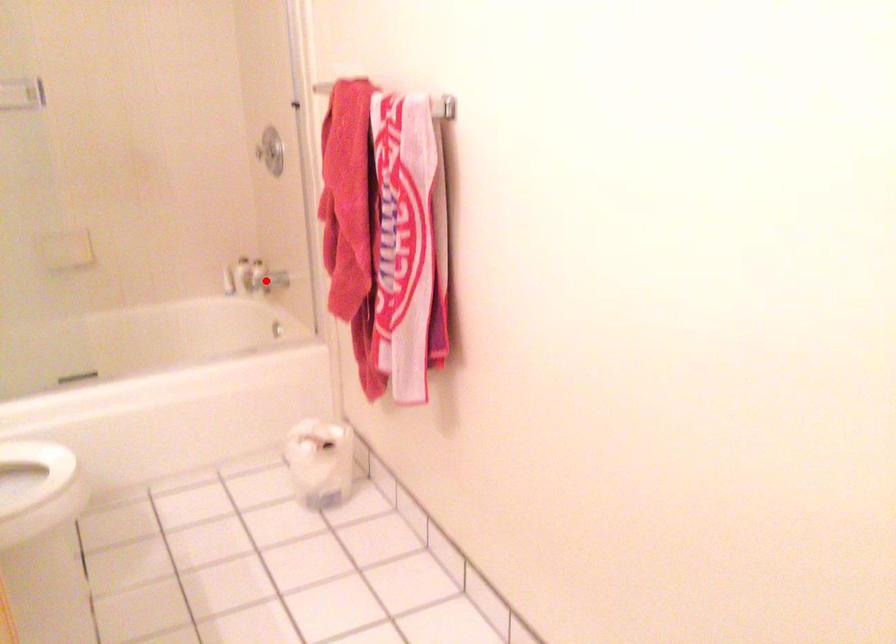
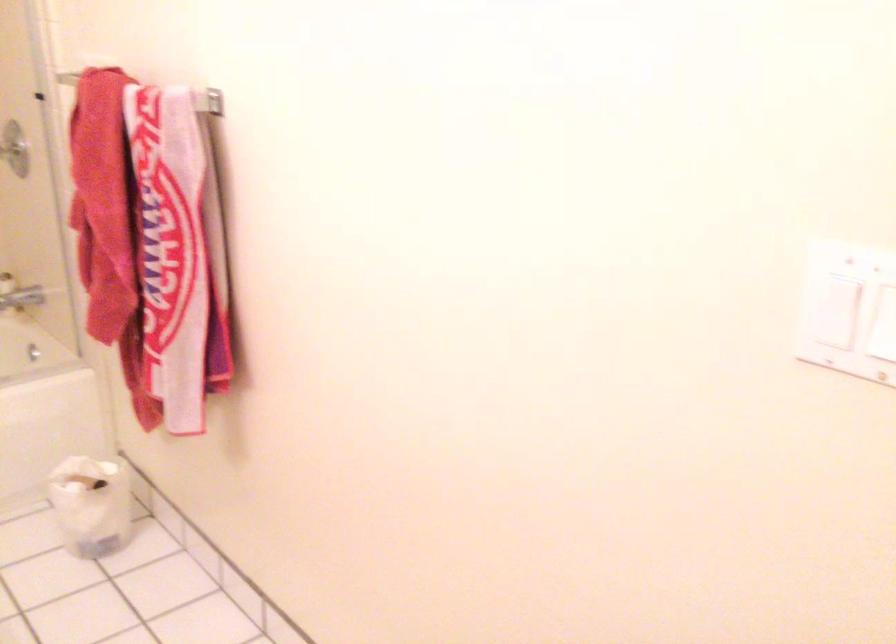
Where in the second image is the point corresponding to the highlighted location from the first image?

(20, 299)